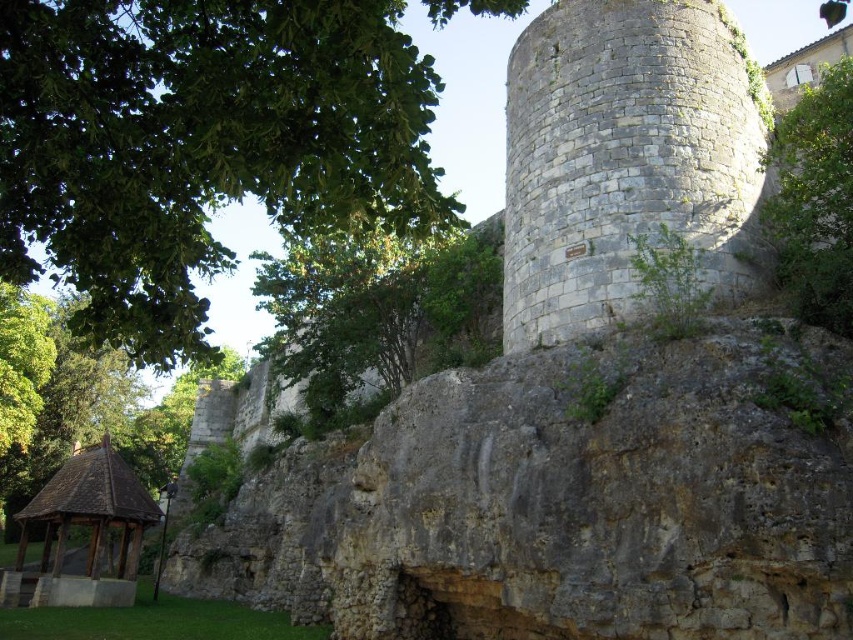
Question: Which object is closer to the camera taking this photo?

Choices:
 (A) green leafy tree at upper center
 (B) green leafy tree at upper right
 (C) green leafy tree at upper left

Answer: (C)

Question: Which object is farther from the camera taking this photo?

Choices:
 (A) brown wooden gazebo at lower left
 (B) green leafy tree at upper center
 (C) green leafy tree at upper right
 (D) gray stone tower at upper right

Answer: (A)

Question: Which object is positioned farthest from the gray stone tower at upper right?

Choices:
 (A) green leafy tree at upper center
 (B) green leafy tree at upper right
 (C) green leafy tree at upper left

Answer: (A)

Question: Is green leafy tree at upper left positioned at the back of brown wooden gazebo at lower left?

Choices:
 (A) yes
 (B) no

Answer: (B)

Question: Does green leafy tree at upper left come in front of brown wooden gazebo at lower left?

Choices:
 (A) yes
 (B) no

Answer: (A)

Question: Is green leafy tree at upper left bigger than green leafy tree at upper right?

Choices:
 (A) no
 (B) yes

Answer: (B)